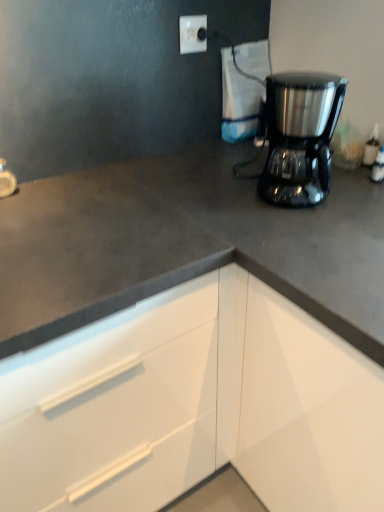
Identify the location of vacant area that is in front of white glossy faucet at upper left. (18, 219).